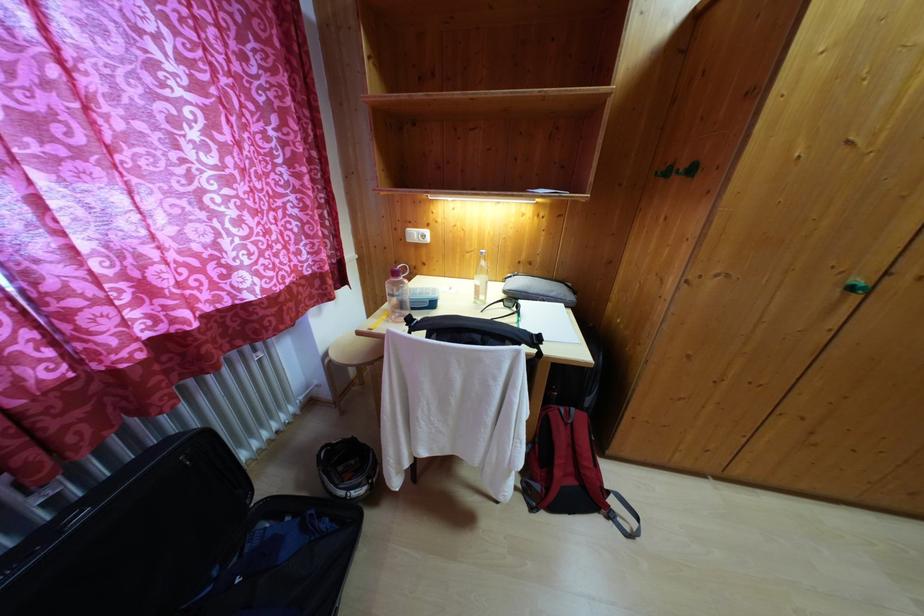
Find the location of `black bag buckle`. black bag buckle is located at coordinates (286, 560).